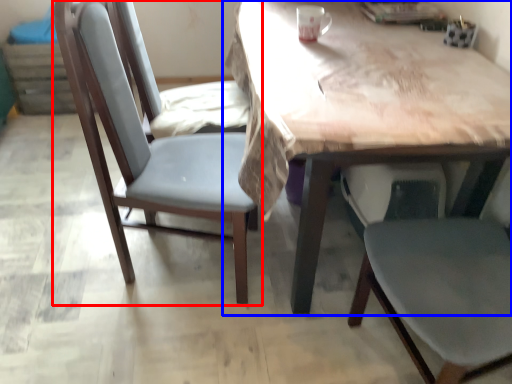
Question: Which of the following is the farthest to the observer, chair (highlighted by a red box) or table (highlighted by a blue box)?

Choices:
 (A) chair
 (B) table

Answer: (A)